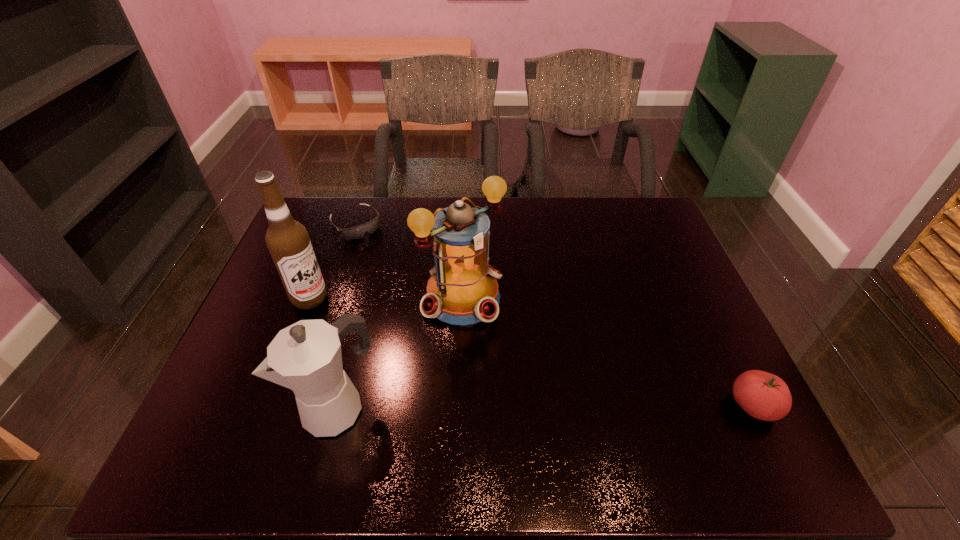
At what (x,y) coordinates should I click in order to perform the action: click on vacant spot on the desktop that is between the third tallest object and the rightmost object and is positioned on the label of the alcohol. Please return your answer as a coordinate pair (x, y). The image size is (960, 540). Looking at the image, I should click on (516, 406).

This screenshot has height=540, width=960. In order to click on vacant spot on the desktop that is between the coffeepot and the second shortest object and is positioned on the front-facing side of the second object from right to left in this screenshot , I will do `click(581, 406)`.

Where is `free space on the desktop that is between the coffeepot and the tomato and is positioned on the lenses of the shortest object`? This screenshot has width=960, height=540. free space on the desktop that is between the coffeepot and the tomato and is positioned on the lenses of the shortest object is located at coordinates (520, 406).